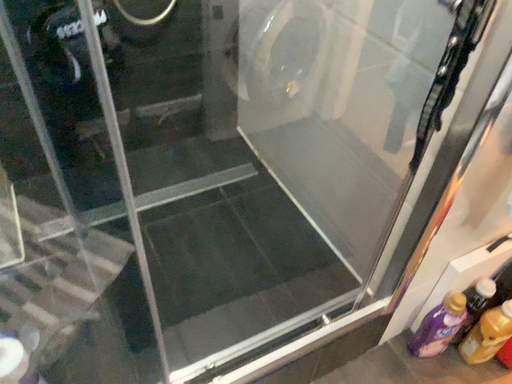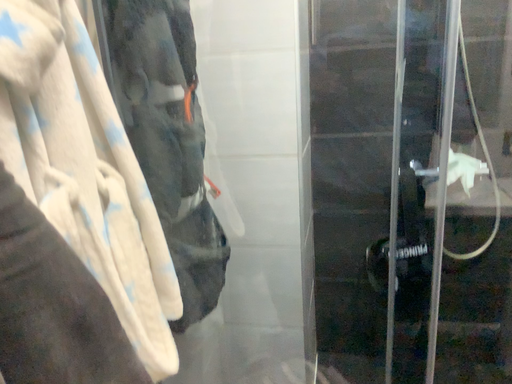
Question: How did the camera likely rotate when shooting the video?

Choices:
 (A) rotated left
 (B) rotated right

Answer: (A)